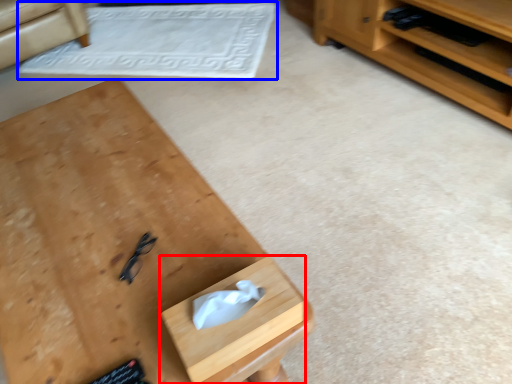
Question: Which object is further to the camera taking this photo, drawer (highlighted by a red box) or mat (highlighted by a blue box)?

Choices:
 (A) drawer
 (B) mat

Answer: (B)